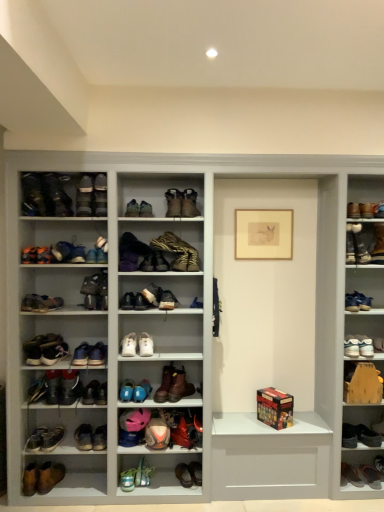
Question: From the image's perspective, is brown suede boot at lower right, the 2th footwear in the right-to-left sequence, located beneath leather snakeskin boot at center, the 18th footwear when ordered from left to right?

Choices:
 (A) yes
 (B) no

Answer: (A)

Question: Considering the relative sizes of brown suede boot at lower right, marked as the 31th footwear in a left-to-right arrangement, and leather snakeskin boot at center, the fifteenth footwear from the right, in the image provided, is brown suede boot at lower right, marked as the 31th footwear in a left-to-right arrangement, thinner than leather snakeskin boot at center, the fifteenth footwear from the right,?

Choices:
 (A) no
 (B) yes

Answer: (B)

Question: Does brown suede boot at lower right, marked as the 31th footwear in a left-to-right arrangement, appear on the right side of leather snakeskin boot at center, the fifteenth footwear from the right?

Choices:
 (A) no
 (B) yes

Answer: (B)

Question: Does brown suede boot at lower right, the 2th footwear in the right-to-left sequence, lie in front of leather snakeskin boot at center, the fifteenth footwear from the right?

Choices:
 (A) no
 (B) yes

Answer: (A)

Question: Is the depth of brown suede boot at lower right, the 2th footwear in the right-to-left sequence, greater than that of leather snakeskin boot at center, the 18th footwear when ordered from left to right?

Choices:
 (A) no
 (B) yes

Answer: (B)

Question: Is white leather sneakers at center, acting as the 22th footwear starting from the right, situated inside brown leather shoes at lower left, arranged as the 3th footwear when viewed from the left, or outside?

Choices:
 (A) inside
 (B) outside

Answer: (B)

Question: Considering the relative positions of white leather sneakers at center, acting as the 22th footwear starting from the right, and brown leather shoes at lower left, acting as the 30th footwear starting from the right, in the image provided, is white leather sneakers at center, acting as the 22th footwear starting from the right, to the left or to the right of brown leather shoes at lower left, acting as the 30th footwear starting from the right,?

Choices:
 (A) right
 (B) left

Answer: (A)

Question: In terms of height, does white leather sneakers at center, which is the eleventh footwear in left-to-right order, look taller or shorter compared to brown leather shoes at lower left, acting as the 30th footwear starting from the right?

Choices:
 (A) tall
 (B) short

Answer: (A)

Question: Is white leather sneakers at center, acting as the 22th footwear starting from the right, in front of or behind brown leather shoes at lower left, acting as the 30th footwear starting from the right, in the image?

Choices:
 (A) front
 (B) behind

Answer: (B)

Question: Considering the positions of matte white sneaker at left, marked as the seventh shoe in a bottom-to-top arrangement, and wooden picture frame at center in the image, is matte white sneaker at left, marked as the seventh shoe in a bottom-to-top arrangement, wider or thinner than wooden picture frame at center?

Choices:
 (A) thin
 (B) wide

Answer: (B)

Question: Considering the relative positions of matte white sneaker at left, marked as the seventh shoe in a bottom-to-top arrangement, and wooden picture frame at center in the image provided, is matte white sneaker at left, marked as the seventh shoe in a bottom-to-top arrangement, to the left or to the right of wooden picture frame at center?

Choices:
 (A) right
 (B) left

Answer: (B)

Question: From the image's perspective, is matte white sneaker at left, placed as the 7th shoe when sorted from top to bottom, above or below wooden picture frame at center?

Choices:
 (A) below
 (B) above

Answer: (A)

Question: From a real-world perspective, is matte white sneaker at left, marked as the seventh shoe in a bottom-to-top arrangement, physically located above or below wooden picture frame at center?

Choices:
 (A) below
 (B) above

Answer: (A)

Question: Considering the positions of leather sneaker at upper left, the 13th shoe positioned from the bottom, and brown suede boot at center, the 11th shoe positioned from the bottom, in the image, is leather sneaker at upper left, the 13th shoe positioned from the bottom, bigger or smaller than brown suede boot at center, the 11th shoe positioned from the bottom,?

Choices:
 (A) big
 (B) small

Answer: (B)

Question: Relative to brown suede boot at center, the 11th shoe positioned from the bottom, is leather sneaker at upper left, the 13th shoe positioned from the bottom, in front or behind?

Choices:
 (A) behind
 (B) front

Answer: (B)